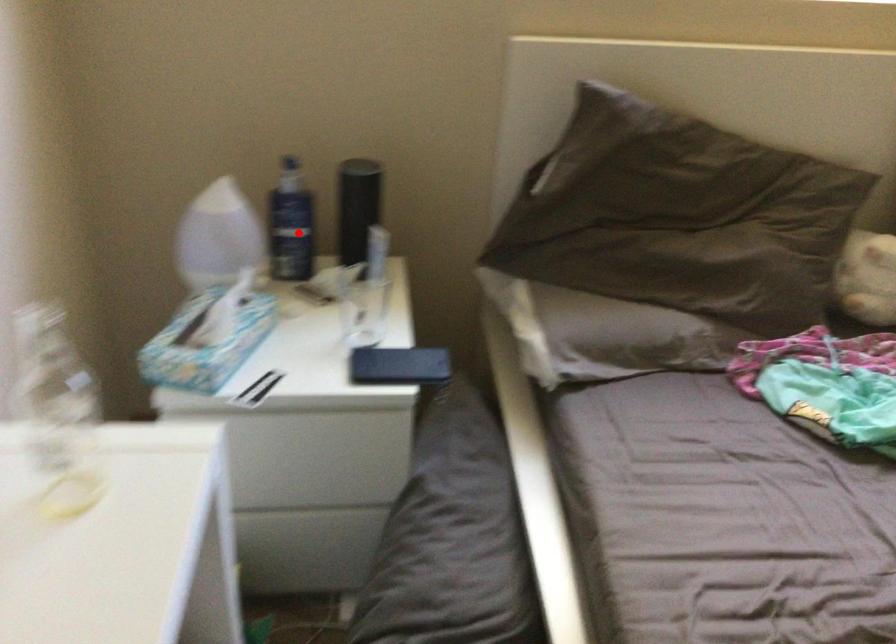
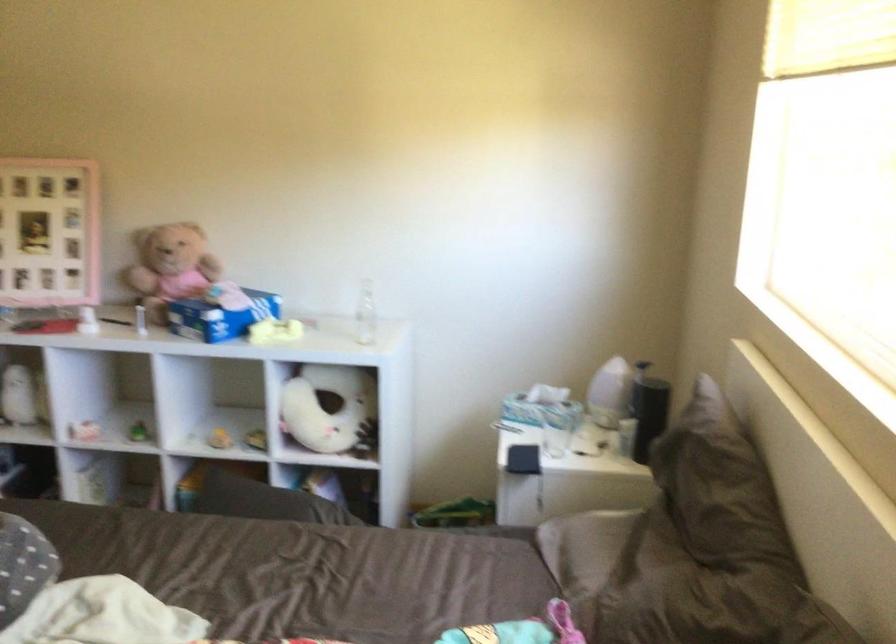
Question: I am providing you with two images of the same scene from different viewpoints. A red point is marked on the first image. Can you still see the location of the red point in image 2?

Choices:
 (A) Yes
 (B) No

Answer: (A)